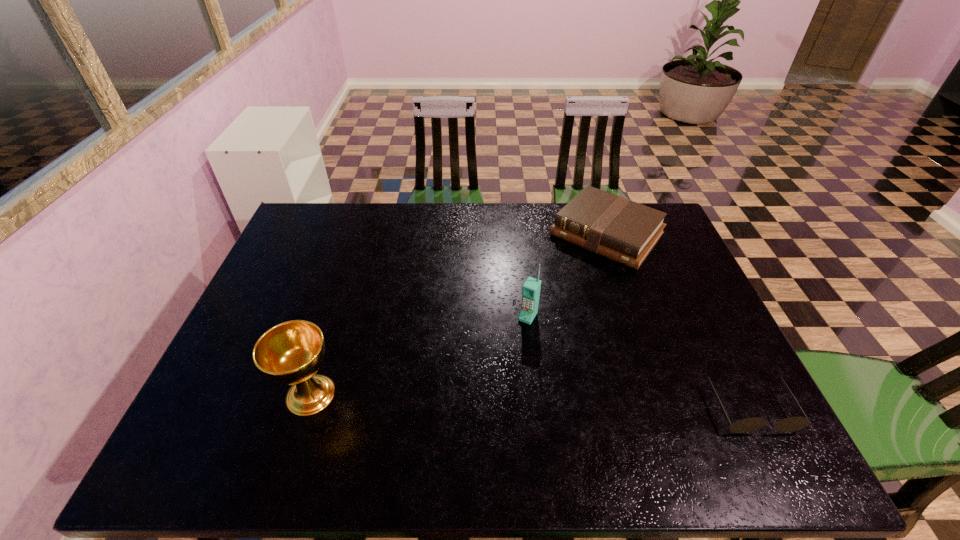
This screenshot has width=960, height=540. I want to click on free space on the desktop that is between the leftmost object and the shortest object and is positioned on the keypad of the third object from right to left, so click(478, 400).

You are a GUI agent. You are given a task and a screenshot of the screen. Output one action in this format:
    pyautogui.click(x=<x>, y=<y>)
    Task: Click on the vacant space on the desktop that is between the chalice and the shortest object and is positioned on the spine side of the Bible
    This screenshot has width=960, height=540.
    Given the screenshot: What is the action you would take?
    pyautogui.click(x=466, y=399)